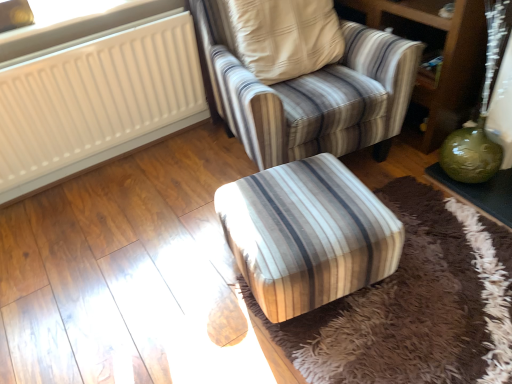
The height and width of the screenshot is (384, 512). I want to click on free space to the right of striped fabric ottoman at center, so click(441, 261).